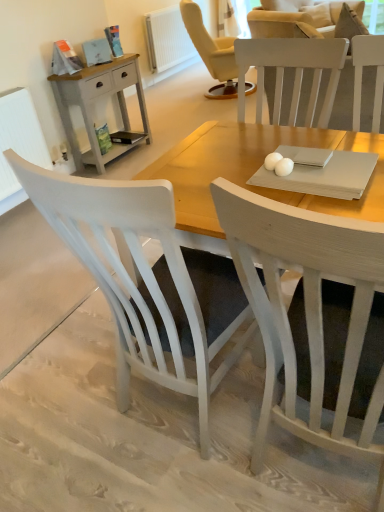
Question: Looking at the image, does matte gray wooden nightstand at left seem bigger or smaller compared to white wood chair at center, positioned as the first chair in left-to-right order?

Choices:
 (A) small
 (B) big

Answer: (A)

Question: From a real-world perspective, is matte gray wooden nightstand at left above or below white wood chair at center, which is the 2th chair in right-to-left order?

Choices:
 (A) above
 (B) below

Answer: (B)

Question: Estimate the real-world distances between objects in this image. Which object is closer to the white wood chair at center, which is the first chair from right to left?

Choices:
 (A) white wood chair at center, which is the 2th chair in right-to-left order
 (B) matte gray wooden nightstand at left
 (C) white textured radiator at left, the 1th radiator viewed from the left
 (D) white painted radiator at upper center, which is the second radiator from left to right

Answer: (A)

Question: Estimate the real-world distances between objects in this image. Which object is farther from the white wood chair at center, positioned as the first chair in left-to-right order?

Choices:
 (A) white wood chair at center, which appears as the second chair when viewed from the left
 (B) white textured radiator at left, the 2th radiator when ordered from right to left
 (C) white painted radiator at upper center, positioned as the 1th radiator in back-to-front order
 (D) matte gray wooden nightstand at left

Answer: (C)